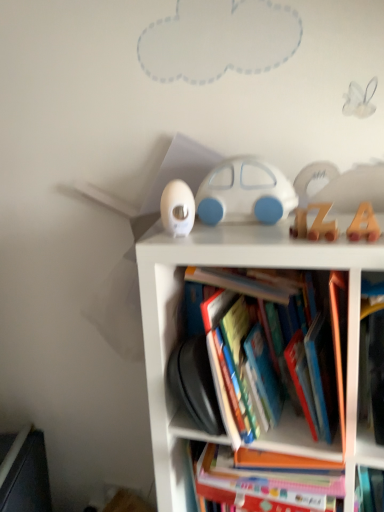
You are a GUI agent. You are given a task and a screenshot of the screen. Output one action in this format:
    pyautogui.click(x=<x>, y=<y>)
    Task: Click on the free space in front of white plastic thermometer at upper left, acting as the second toy starting from the back
    The width and height of the screenshot is (384, 512).
    Given the screenshot: What is the action you would take?
    pyautogui.click(x=187, y=239)